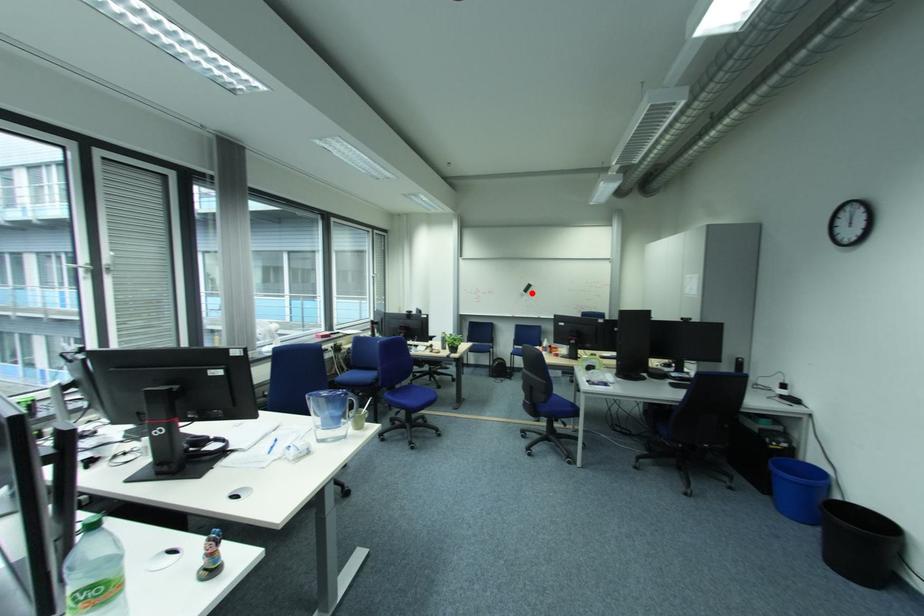
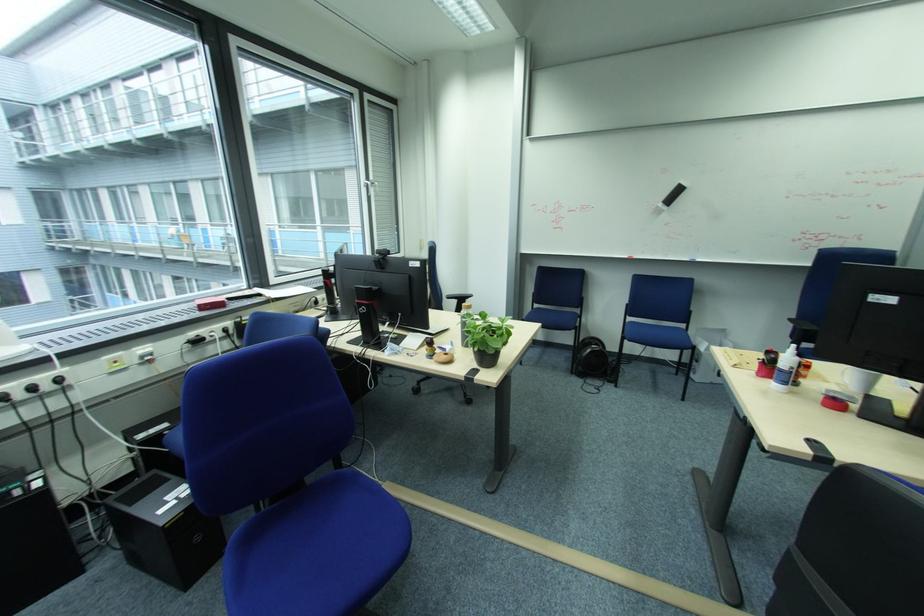
Find the pixel in the second image that matches the highlighted location in the first image.

(669, 206)